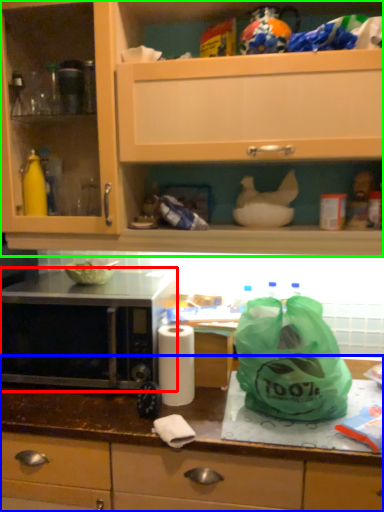
Question: Considering the real-world distances, which object is farthest from microwave oven (highlighted by a red box)? countertop (highlighted by a blue box) or cabinetry (highlighted by a green box)?

Choices:
 (A) countertop
 (B) cabinetry

Answer: (B)